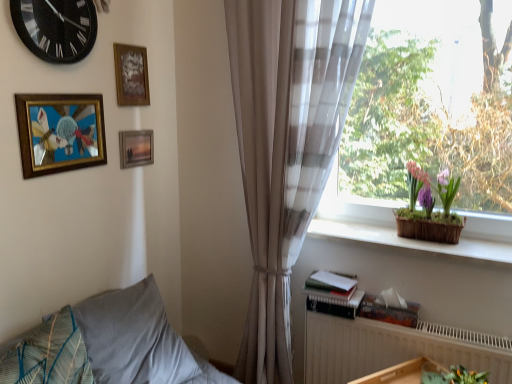
What are the coordinates of `blank space situated above matte brown pot at window (from a real-world perspective)` in the screenshot? It's located at [433, 160].